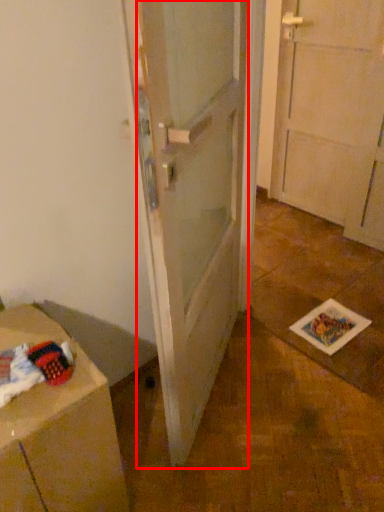
Question: In this image, where is door (annotated by the red box) located relative to cabinetry?

Choices:
 (A) right
 (B) left

Answer: (A)